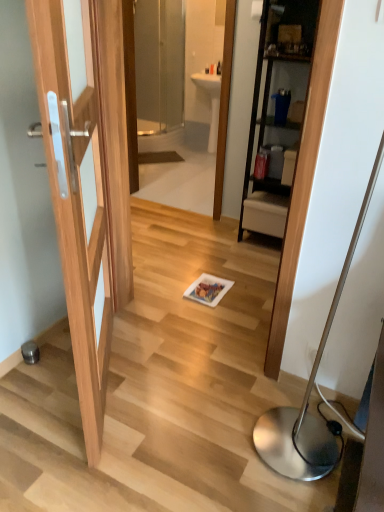
Question: Is the surface of transparent glass mirror at upper center in direct contact with silver metallic floor lamp at lower right?

Choices:
 (A) yes
 (B) no

Answer: (B)

Question: Would you say silver metallic floor lamp at lower right is part of transparent glass mirror at upper center's contents?

Choices:
 (A) no
 (B) yes

Answer: (A)

Question: Is transparent glass mirror at upper center shorter than silver metallic floor lamp at lower right?

Choices:
 (A) yes
 (B) no

Answer: (B)

Question: Is transparent glass mirror at upper center thinner than silver metallic floor lamp at lower right?

Choices:
 (A) no
 (B) yes

Answer: (B)

Question: From a real-world perspective, is transparent glass mirror at upper center over silver metallic floor lamp at lower right?

Choices:
 (A) yes
 (B) no

Answer: (A)

Question: Considering the positions of white glossy sink at center and transparent glass mirror at upper center in the image, is white glossy sink at center wider or thinner than transparent glass mirror at upper center?

Choices:
 (A) thin
 (B) wide

Answer: (B)

Question: From the image's perspective, is white glossy sink at center positioned above or below transparent glass mirror at upper center?

Choices:
 (A) above
 (B) below

Answer: (A)

Question: Is point (213, 114) positioned closer to the camera than point (187, 66)?

Choices:
 (A) closer
 (B) farther

Answer: (A)

Question: Which is correct: white glossy sink at center is inside transparent glass mirror at upper center, or outside of it?

Choices:
 (A) inside
 (B) outside

Answer: (B)

Question: From a real-world perspective, is white glossy sink at center physically located above or below transparent glass screen door at upper center?

Choices:
 (A) above
 (B) below

Answer: (B)

Question: Is white glossy sink at center to the left or to the right of transparent glass screen door at upper center in the image?

Choices:
 (A) right
 (B) left

Answer: (A)

Question: Based on their sizes in the image, would you say white glossy sink at center is bigger or smaller than transparent glass screen door at upper center?

Choices:
 (A) small
 (B) big

Answer: (A)

Question: From the image's perspective, is white glossy sink at center positioned above or below transparent glass screen door at upper center?

Choices:
 (A) above
 (B) below

Answer: (B)

Question: Is silver metallic floor lamp at lower right bigger or smaller than transparent glass mirror at upper center?

Choices:
 (A) small
 (B) big

Answer: (B)

Question: Is silver metallic floor lamp at lower right inside or outside of transparent glass mirror at upper center?

Choices:
 (A) inside
 (B) outside

Answer: (B)